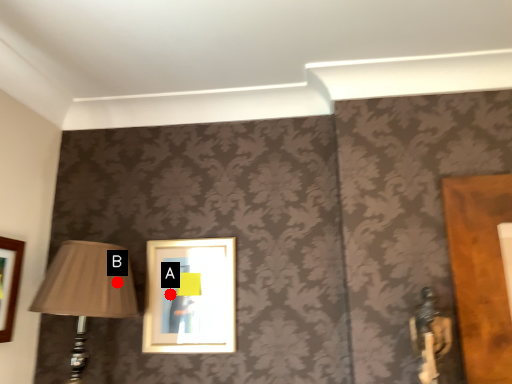
Question: Two points are circled on the image, labeled by A and B beside each circle. Among these points, which one is farthest from the camera?

Choices:
 (A) A is further
 (B) B is further

Answer: (A)